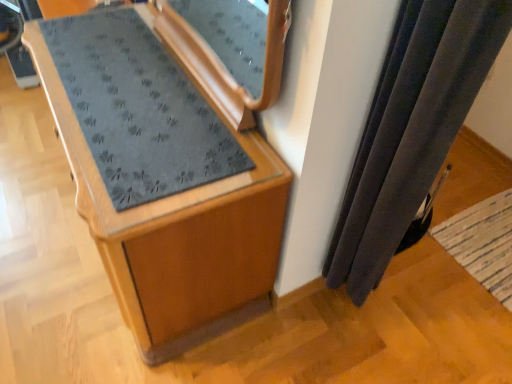
Question: Is woven beige mat at lower right facing away from velvet dark gray curtain at right?

Choices:
 (A) no
 (B) yes

Answer: (A)

Question: Is woven beige mat at lower right surrounding velvet dark gray curtain at right?

Choices:
 (A) no
 (B) yes

Answer: (A)

Question: From a real-world perspective, is woven beige mat at lower right located higher than velvet dark gray curtain at right?

Choices:
 (A) no
 (B) yes

Answer: (A)

Question: Is woven beige mat at lower right smaller than velvet dark gray curtain at right?

Choices:
 (A) yes
 (B) no

Answer: (A)

Question: Is there a large distance between woven beige mat at lower right and velvet dark gray curtain at right?

Choices:
 (A) no
 (B) yes

Answer: (A)

Question: Considering the relative sizes of woven beige mat at lower right and velvet dark gray curtain at right in the image provided, is woven beige mat at lower right wider than velvet dark gray curtain at right?

Choices:
 (A) yes
 (B) no

Answer: (A)

Question: Does woven beige mat at lower right appear on the left side of wooden cabinet at center?

Choices:
 (A) no
 (B) yes

Answer: (A)

Question: Is woven beige mat at lower right next to wooden cabinet at center and touching it?

Choices:
 (A) no
 (B) yes

Answer: (A)

Question: From the image's perspective, would you say woven beige mat at lower right is shown under wooden cabinet at center?

Choices:
 (A) no
 (B) yes

Answer: (B)

Question: Does woven beige mat at lower right have a lesser height compared to wooden cabinet at center?

Choices:
 (A) no
 (B) yes

Answer: (B)

Question: Is wooden cabinet at center surrounded by woven beige mat at lower right?

Choices:
 (A) yes
 (B) no

Answer: (B)

Question: Is woven beige mat at lower right looking in the opposite direction of wooden cabinet at center?

Choices:
 (A) no
 (B) yes

Answer: (A)

Question: Would you say wooden cabinet at center is part of velvet dark gray curtain at right's contents?

Choices:
 (A) no
 (B) yes

Answer: (A)